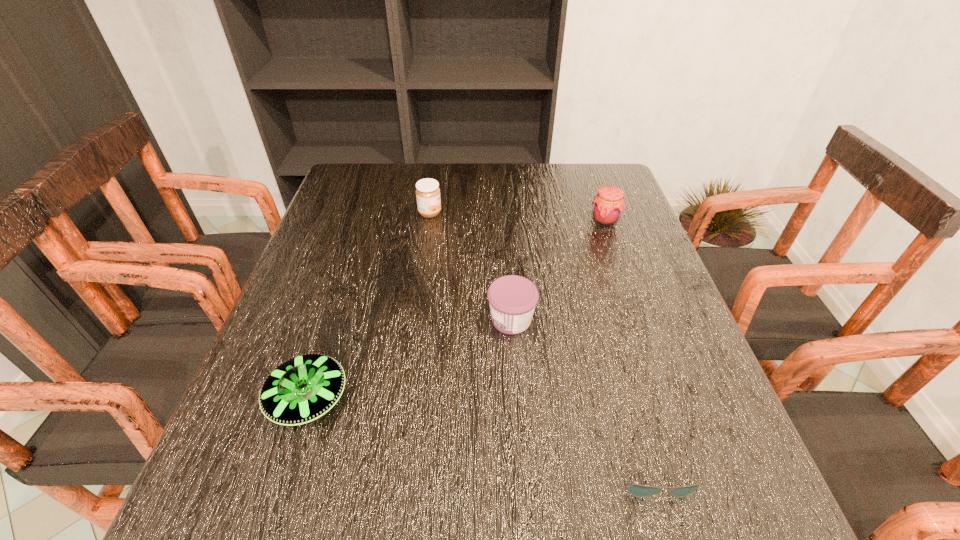
This screenshot has width=960, height=540. In order to click on vacant space at the left edge in this screenshot , I will do `click(365, 264)`.

In the image, there is a desktop. Where is `vacant space at the right edge`? vacant space at the right edge is located at coordinates (638, 291).

In the image, there is a desktop. Where is `vacant space at the far left corner`? This screenshot has height=540, width=960. vacant space at the far left corner is located at coordinates (365, 186).

The height and width of the screenshot is (540, 960). Identify the location of vacant space at the far right corner of the desktop. (588, 187).

The width and height of the screenshot is (960, 540). In order to click on free area in between the leftmost jam and the sunglasses in this screenshot , I will do `click(540, 340)`.

Locate an element on the screen. The height and width of the screenshot is (540, 960). blank region between the third object from right to left and the sunglasses is located at coordinates 581,393.

The height and width of the screenshot is (540, 960). I want to click on empty location between the third nearest object and the fourth object from right to left, so click(x=470, y=266).

Locate an element on the screen. The height and width of the screenshot is (540, 960). empty space that is in between the shortest object and the second shortest object is located at coordinates (480, 433).

I want to click on empty space that is in between the second jam from right to left and the leftmost object, so click(410, 359).

Identify the location of unoccupied position between the saucer and the fourth object from right to left. The image size is (960, 540). (x=369, y=306).